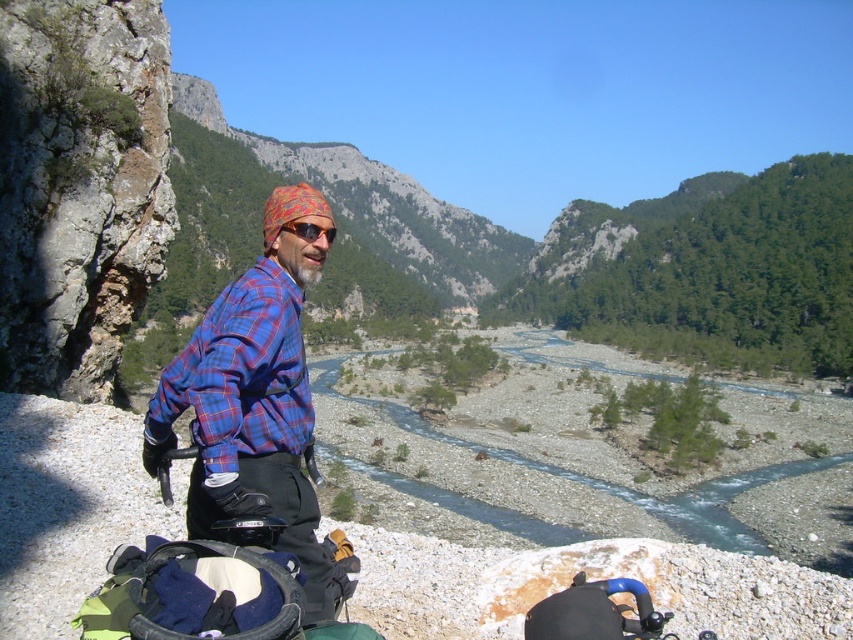
Is blue plaid shirt at center bigger than blue plaid shirt at left?

Indeed, blue plaid shirt at center has a larger size compared to blue plaid shirt at left.

Does blue plaid shirt at center lie in front of blue plaid shirt at left?

Yes, it is.

Where is `blue plaid shirt at center`? This screenshot has height=640, width=853. blue plaid shirt at center is located at coordinates (254, 401).

Find the location of `blue plaid shirt at center`. blue plaid shirt at center is located at coordinates (254, 401).

Is blue plaid shirt at center shorter than matte orange goggles at center?

In fact, blue plaid shirt at center may be taller than matte orange goggles at center.

Does point (279, 362) come behind point (328, 228)?

No, (279, 362) is in front of (328, 228).

Find the location of a particular element. This screenshot has width=853, height=640. blue plaid shirt at center is located at coordinates point(254,401).

Find the location of a particular element. This screenshot has width=853, height=640. blue plaid shirt at center is located at coordinates point(254,401).

Does blue plaid shirt at left have a lesser width compared to matte orange goggles at center?

Incorrect, blue plaid shirt at left's width is not less than matte orange goggles at center's.

This screenshot has width=853, height=640. I want to click on blue plaid shirt at left, so click(241, 376).